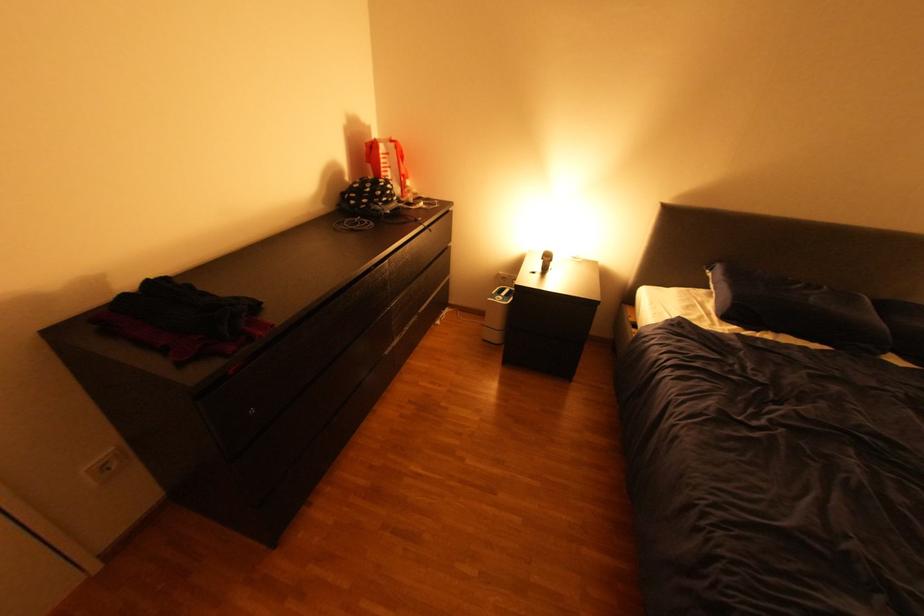
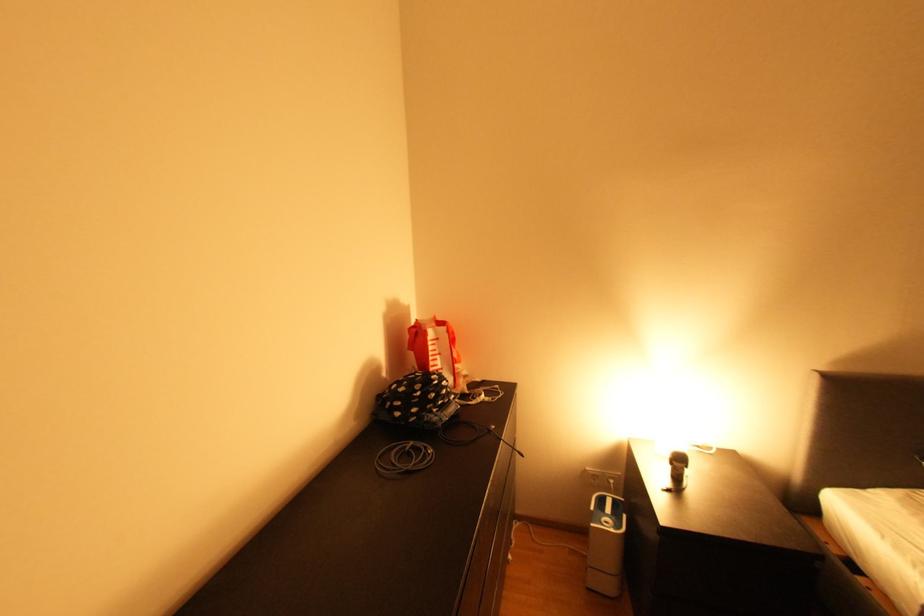
In the second image, find the point that corresponds to pixel 372 222 in the first image.

(428, 450)